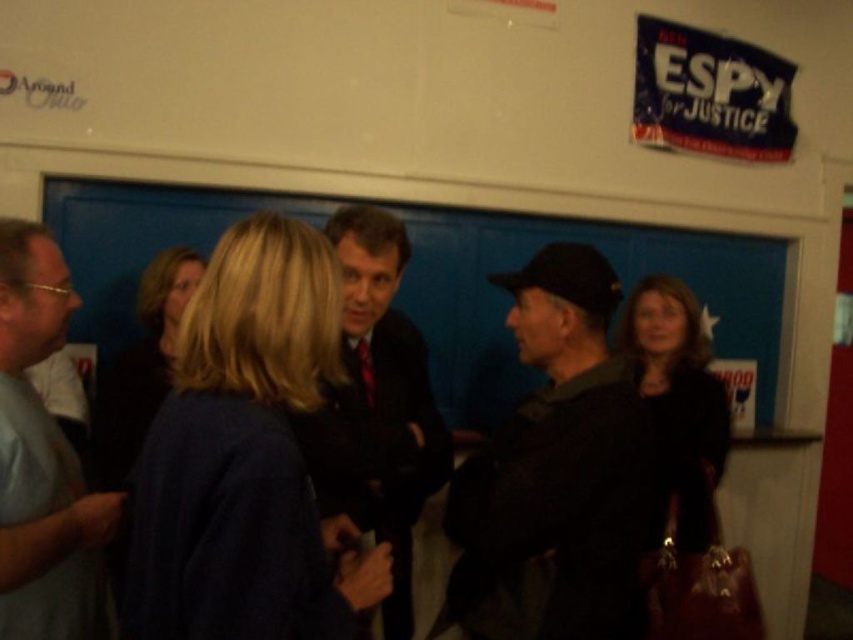
You are standing in the room and want to hand a document to the person wearing the dark gray fabric jacket at center and the matte black jacket at right. Which one should you approach first based on their positions?

You should approach the dark gray fabric jacket at center first because it is closer to you than the matte black jacket at right.

Consider the image. Please describe the position of the dark gray fabric jacket at center in terms of coordinates within the image frame. The image frame has a coordinate system where the origin is at the bottom left corner, with x increasing to the right and y increasing upwards. The coordinates are normalized between 0 and 1. Please provide the coordinates as a tuple of two decimal numbers rounded to three decimal places.

The dark gray fabric jacket at center is located at coordinates approximately equal to the point given in the Objects Description, which is at point (556, 470). Therefore, the coordinates are approximately rounded to three decimal places as the tuple of two decimal numbers, so the answer is the tuple of the coordinates given.